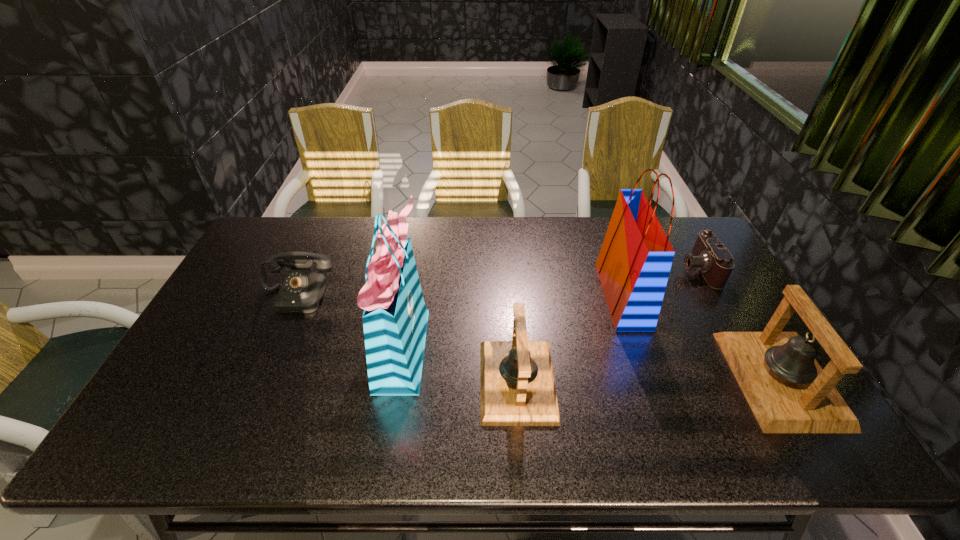
The height and width of the screenshot is (540, 960). I want to click on shopping bag located at the near edge, so 395,317.

Find the location of a particular element. The image size is (960, 540). object at the left edge is located at coordinates (301, 292).

Where is `bell located at the right edge`? bell located at the right edge is located at coordinates (788, 391).

You are a GUI agent. You are given a task and a screenshot of the screen. Output one action in this format:
    pyautogui.click(x=<x>, y=<y>)
    Task: Click on the camera that is at the right edge
    
    Given the screenshot: What is the action you would take?
    [715, 262]

The height and width of the screenshot is (540, 960). In order to click on object at the far right corner in this screenshot , I will do `click(715, 262)`.

The image size is (960, 540). What are the coordinates of `object at the near right corner` in the screenshot? It's located at (788, 391).

Locate an element on the screen. The width and height of the screenshot is (960, 540). free point at the far edge is located at coordinates (597, 230).

Locate an element on the screen. free space at the near edge of the desktop is located at coordinates (345, 403).

Identify the location of free region at the right edge of the desktop. (707, 328).

The height and width of the screenshot is (540, 960). Identify the location of blank area at the far left corner. (302, 222).